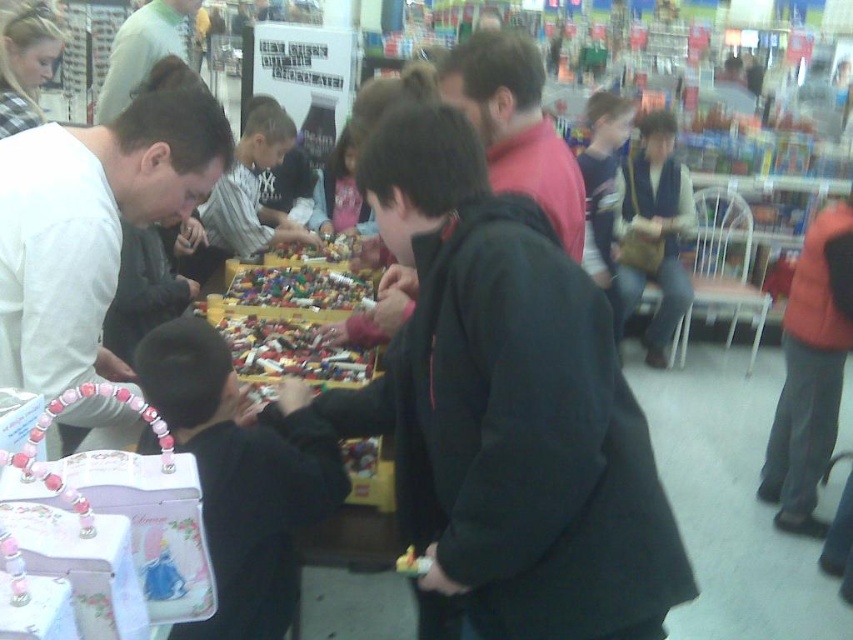
You are a store employee and you see the brown leather purse at center and the matte pink shirt at center. Which item is positioned more to the right side of the scene?

The brown leather purse at center is positioned to the right of the matte pink shirt at center, so the brown leather purse at center is more to the right.

You are standing at the entrance of the toy store and see two points marked on the floor. The first point is at coordinate point (x=315, y=280) and the second is at point (x=320, y=189). Which point is closer to you?

Point (x=315, y=280) is in front of point (x=320, y=189), so it is closer to you.

You are a store employee who needs to place a new item on the shelf. The shelf has a height limit of 1 meter. You have the brown leather purse at center and the matte pink shirt at center in your hands. Based on their sizes, which item can you safely place on the shelf without exceeding the height limit?

The brown leather purse at center is taller than the matte pink shirt at center. Since the shelf has a height limit of 1 meter, both items can be placed on the shelf as their heights are likely under the limit. However, if the purse exceeds the limit, prioritize placing the matte pink shirt at center first.